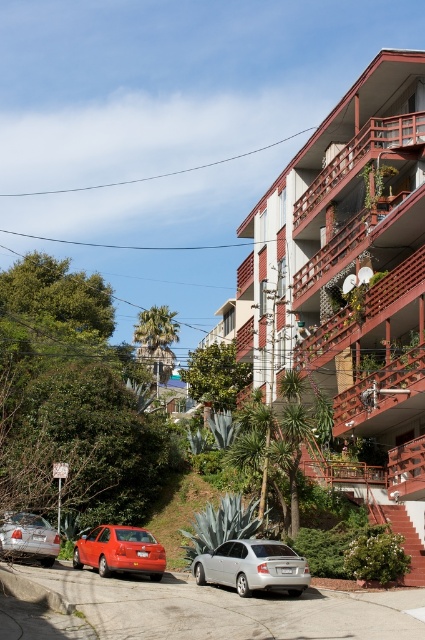
Does wooden balcony at upper right have a greater width compared to silver metallic sedan at lower left?

Indeed, wooden balcony at upper right has a greater width compared to silver metallic sedan at lower left.

Between wooden balcony at upper right and silver metallic sedan at lower left, which one appears on the left side from the viewer's perspective?

From the viewer's perspective, silver metallic sedan at lower left appears more on the left side.

The width and height of the screenshot is (425, 640). In order to click on wooden balcony at upper right in this screenshot , I will do `click(359, 156)`.

Image resolution: width=425 pixels, height=640 pixels. Find the location of `wooden balcony at upper right`. wooden balcony at upper right is located at coordinates (359, 156).

Who is more forward, (374,147) or (152,540)?

Positioned in front is point (152,540).

How much distance is there between wooden balcony at upper right and shiny red sedan at lower left?

The distance of wooden balcony at upper right from shiny red sedan at lower left is 119.63 feet.

Which is in front, point (385, 134) or point (130, 531)?

Positioned in front is point (130, 531).

In order to click on wooden balcony at upper right in this screenshot , I will do `click(359, 156)`.

Who is more distant from viewer, [119,566] or [50,541]?

Positioned behind is point [50,541].

This screenshot has height=640, width=425. Describe the element at coordinates (119, 552) in the screenshot. I see `shiny red sedan at lower left` at that location.

Measure the distance between shiny red sedan at lower left and camera.

47.90 meters

I want to click on shiny red sedan at lower left, so pyautogui.click(x=119, y=552).